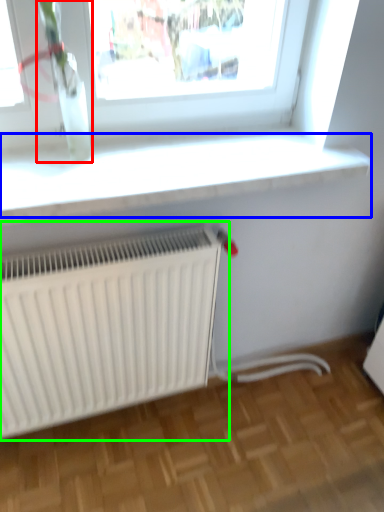
Question: Based on their relative distances, which object is farther from plant (highlighted by a red box)? Choose from window sill (highlighted by a blue box) and radiator (highlighted by a green box).

Choices:
 (A) window sill
 (B) radiator

Answer: (B)